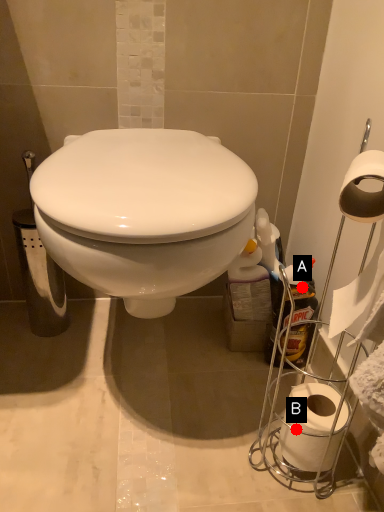
Question: Two points are circled on the image, labeled by A and B beside each circle. Which point appears closest to the camera in this image?

Choices:
 (A) A is closer
 (B) B is closer

Answer: (B)